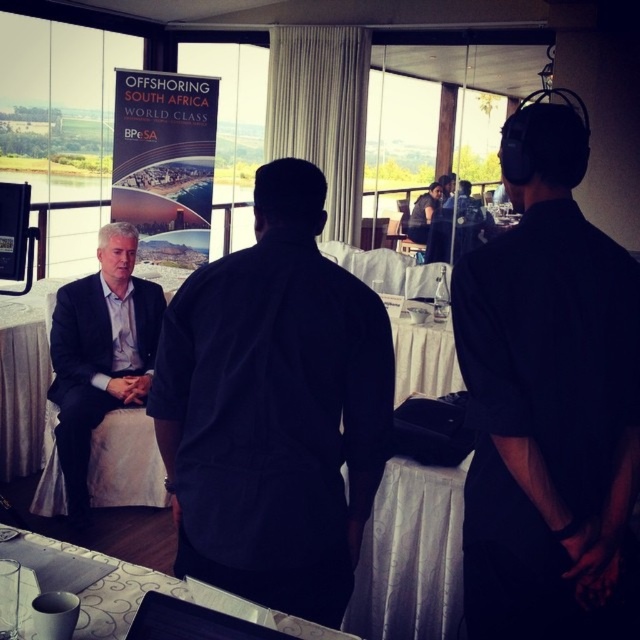
In the scene shown: You are standing at the center of the room. Where is the matte black suit at left located relative to your position?

The matte black suit at left is located at point 0.552 on the x axis and 0.158 on the y axis relative to your position.

You are a photographer positioned at the entrance of the conference room. You need to take a photo that includes both the dark blue shirt at center and the matte black suit at left. The camera you are using has a focal length of 50mm and a sensor size that allows for a maximum subject distance of 6 feet. Will both subjects be in frame?

The dark blue shirt at center and matte black suit at left are 5.93 feet apart from each other. Since the maximum subject distance the camera can handle is 6 feet, the 5.93 feet distance is within the limit. Therefore, both subjects will be in frame.